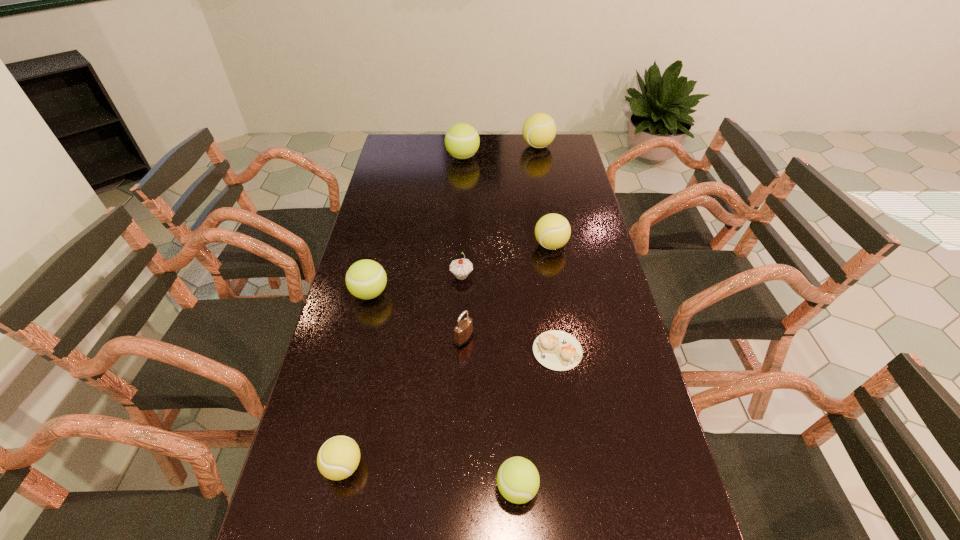
Locate an element on the screen. the farthest yellow tennis ball is located at coordinates (539, 130).

The width and height of the screenshot is (960, 540). In order to click on the second green tennis ball from left to right in this screenshot , I will do `click(462, 141)`.

Locate an element on the screen. This screenshot has height=540, width=960. the biggest green tennis ball is located at coordinates (462, 141).

At what (x,y) coordinates should I click in order to perform the action: click on the fourth nearest tennis ball. Please return your answer as a coordinate pair (x, y). This screenshot has width=960, height=540. Looking at the image, I should click on (552, 231).

Where is `the second nearest yellow tennis ball`? Image resolution: width=960 pixels, height=540 pixels. the second nearest yellow tennis ball is located at coordinates (552, 231).

Where is `the third nearest tennis ball`? the third nearest tennis ball is located at coordinates (366, 279).

The height and width of the screenshot is (540, 960). In order to click on the leftmost green tennis ball in this screenshot , I will do `click(366, 279)`.

This screenshot has height=540, width=960. I want to click on cupcake, so (x=460, y=268).

The image size is (960, 540). I want to click on padlock, so [463, 332].

The width and height of the screenshot is (960, 540). In order to click on the leftmost yellow tennis ball in this screenshot , I will do `click(337, 459)`.